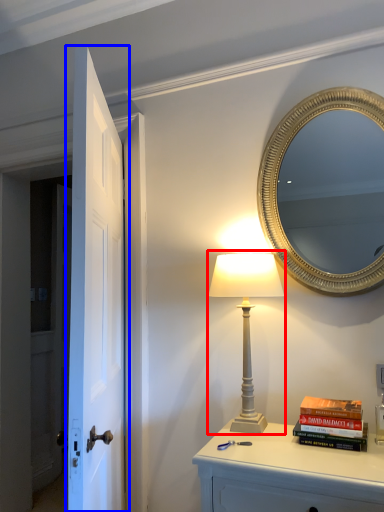
Question: Which object is closer to the camera taking this photo, table lamp (highlighted by a red box) or door (highlighted by a blue box)?

Choices:
 (A) table lamp
 (B) door

Answer: (B)